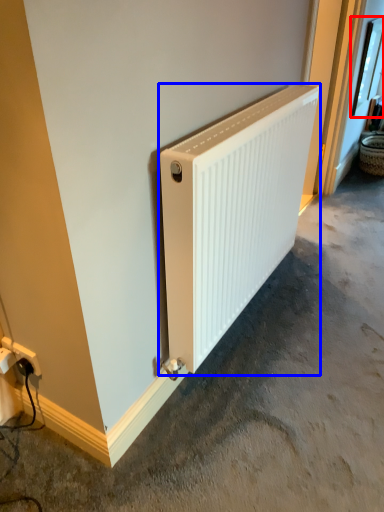
Question: Which point is closer to the camera, window (highlighted by a red box) or radiator (highlighted by a blue box)?

Choices:
 (A) window
 (B) radiator

Answer: (B)